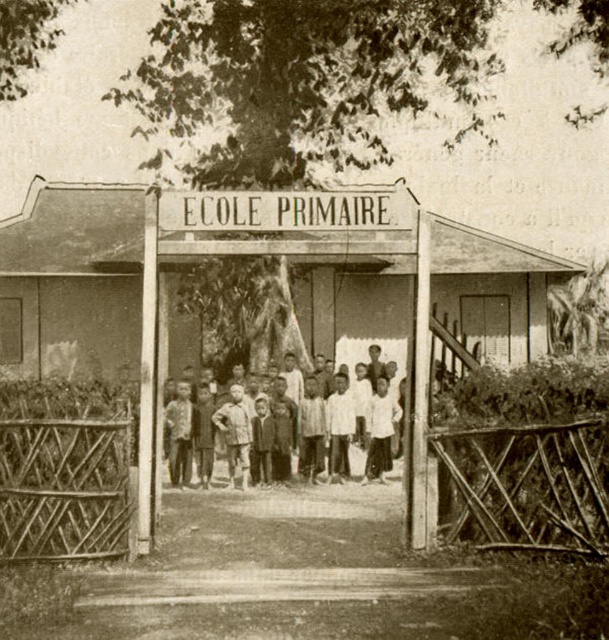
You are standing in front of the school entrance and want to take a photo that includes both the wooden gate and the school building. Which of the two points, point 1 at coordinates [513,305] or point 2 at coordinates [308,404], should you focus on to ensure both the gate and the building are in clear view?

You should focus on point 1 at coordinates [513,305] because it is closer to the camera than point 2 at coordinates [308,404], ensuring both the wooden gate and the school building remain in clear view.